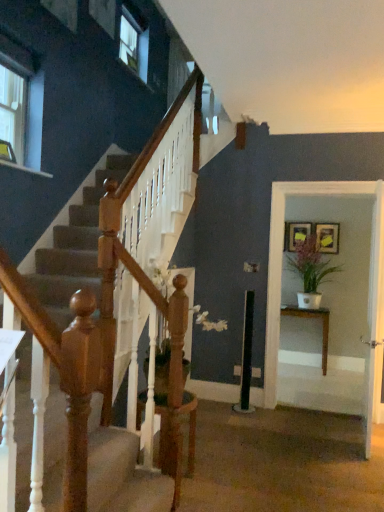
Identify the location of vacant space situated on the left part of white glossy door at center. (308, 438).